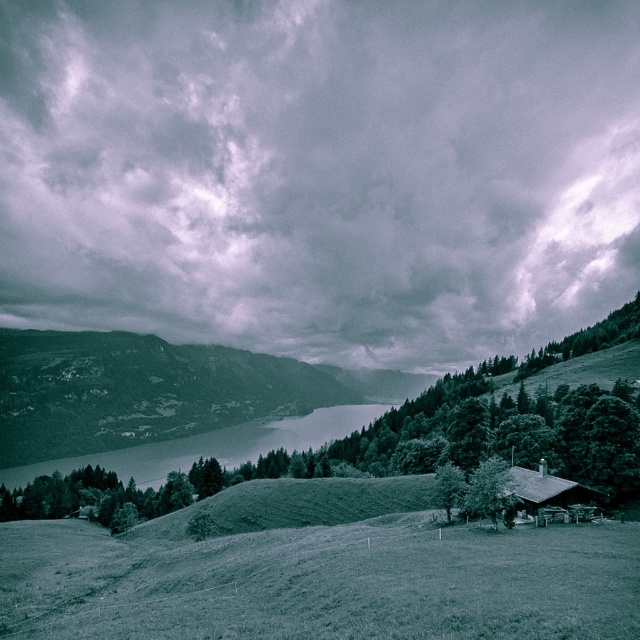
Question: Can you confirm if cloudy sky at upper center is smaller than smooth water at center?

Choices:
 (A) yes
 (B) no

Answer: (B)

Question: Does smooth water at center have a greater width compared to green leafy tree at lower right?

Choices:
 (A) yes
 (B) no

Answer: (A)

Question: Which point is closer to the camera?

Choices:
 (A) (547, 481)
 (B) (627, 173)
 (C) (154, 460)

Answer: (A)

Question: Which of the following is the closest to the observer?

Choices:
 (A) (236, 461)
 (B) (472, 493)
 (C) (564, 508)

Answer: (B)

Question: Can you confirm if smooth water at center is positioned below green leafy tree at lower right?

Choices:
 (A) no
 (B) yes

Answer: (B)

Question: Which point is farther to the camera?

Choices:
 (A) wooden cabin at center-right
 (B) green leafy tree at lower right
 (C) green matte tree at lower right
 (D) cloudy sky at upper center

Answer: (D)